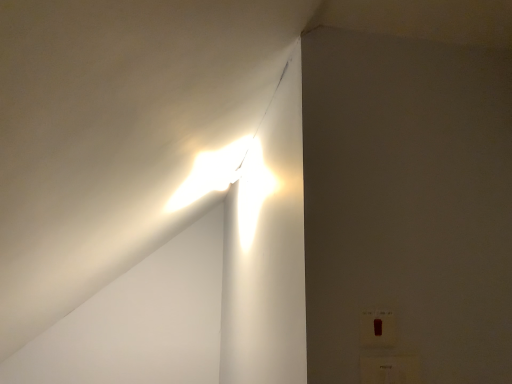
Question: Should I look upward or downward to see white plastic electric outlet at lower right, which is the first electric outlet from bottom to top?

Choices:
 (A) down
 (B) up

Answer: (A)

Question: Can you confirm if white plastic electric outlet at lower right, which appears as the 2th electric outlet when viewed from the top, is smaller than matte white switch at lower right, placed as the second electric outlet when sorted from bottom to top?

Choices:
 (A) no
 (B) yes

Answer: (A)

Question: Is white plastic electric outlet at lower right, which appears as the 2th electric outlet when viewed from the top, at the left side of matte white switch at lower right, arranged as the 1th electric outlet when viewed from the top?

Choices:
 (A) yes
 (B) no

Answer: (B)

Question: From the image's perspective, is white plastic electric outlet at lower right, which is the first electric outlet from bottom to top, on top of matte white switch at lower right, placed as the second electric outlet when sorted from bottom to top?

Choices:
 (A) no
 (B) yes

Answer: (A)

Question: Does white plastic electric outlet at lower right, which appears as the 2th electric outlet when viewed from the top, have a greater width compared to matte white switch at lower right, arranged as the 1th electric outlet when viewed from the top?

Choices:
 (A) yes
 (B) no

Answer: (A)

Question: Is white plastic electric outlet at lower right, which is the first electric outlet from bottom to top, turned away from matte white switch at lower right, arranged as the 1th electric outlet when viewed from the top?

Choices:
 (A) yes
 (B) no

Answer: (B)

Question: From a real-world perspective, is white plastic electric outlet at lower right, which appears as the 2th electric outlet when viewed from the top, under matte white switch at lower right, arranged as the 1th electric outlet when viewed from the top?

Choices:
 (A) yes
 (B) no

Answer: (A)

Question: Is matte white switch at lower right, arranged as the 1th electric outlet when viewed from the top, not inside white plastic electric outlet at lower right, which is the first electric outlet from bottom to top?

Choices:
 (A) yes
 (B) no

Answer: (A)

Question: From the image's perspective, is matte white switch at lower right, placed as the second electric outlet when sorted from bottom to top, above white plastic electric outlet at lower right, which appears as the 2th electric outlet when viewed from the top?

Choices:
 (A) no
 (B) yes

Answer: (B)

Question: Considering the relative positions of matte white switch at lower right, arranged as the 1th electric outlet when viewed from the top, and white plastic electric outlet at lower right, which appears as the 2th electric outlet when viewed from the top, in the image provided, is matte white switch at lower right, arranged as the 1th electric outlet when viewed from the top, to the left of white plastic electric outlet at lower right, which appears as the 2th electric outlet when viewed from the top, from the viewer's perspective?

Choices:
 (A) no
 (B) yes

Answer: (B)

Question: Is matte white switch at lower right, arranged as the 1th electric outlet when viewed from the top, positioned in front of white plastic electric outlet at lower right, which appears as the 2th electric outlet when viewed from the top?

Choices:
 (A) no
 (B) yes

Answer: (A)

Question: Is matte white switch at lower right, arranged as the 1th electric outlet when viewed from the top, far from white plastic electric outlet at lower right, which appears as the 2th electric outlet when viewed from the top?

Choices:
 (A) yes
 (B) no

Answer: (B)

Question: Is matte white switch at lower right, placed as the second electric outlet when sorted from bottom to top, smaller than white plastic electric outlet at lower right, which is the first electric outlet from bottom to top?

Choices:
 (A) no
 (B) yes

Answer: (B)

Question: Considering the positions of white plastic electric outlet at lower right, which appears as the 2th electric outlet when viewed from the top, and matte white switch at lower right, arranged as the 1th electric outlet when viewed from the top, in the image, is white plastic electric outlet at lower right, which appears as the 2th electric outlet when viewed from the top, wider or thinner than matte white switch at lower right, arranged as the 1th electric outlet when viewed from the top,?

Choices:
 (A) thin
 (B) wide

Answer: (B)